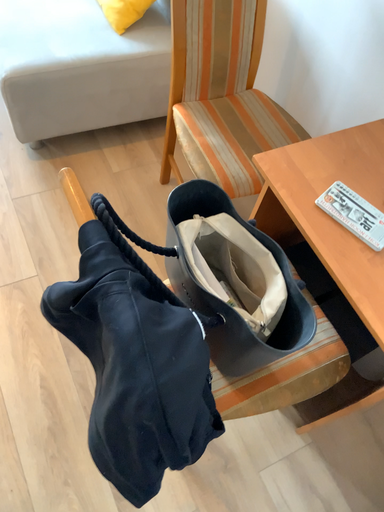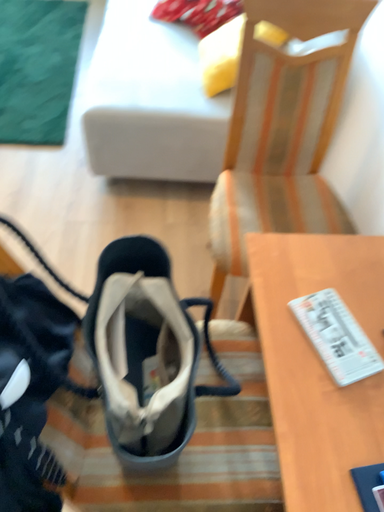
Question: How did the camera likely rotate when shooting the video?

Choices:
 (A) rotated downward
 (B) rotated upward

Answer: (B)